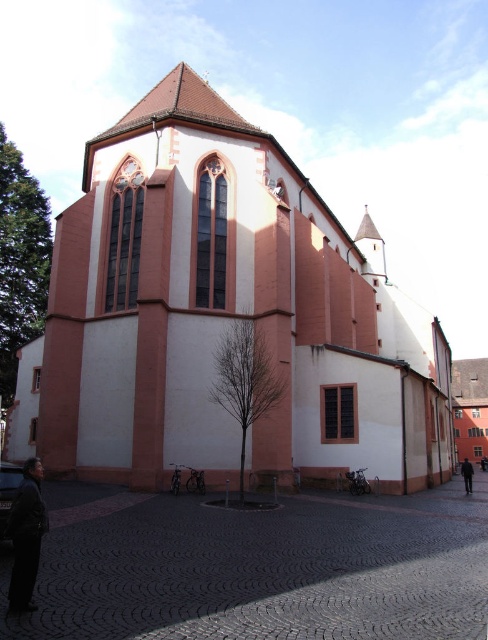
You are standing on the cobblestone path in front of the pink matte church at center. You see a black leather jacket at lower left. Which object is taller?

The pink matte church at center is taller than the black leather jacket at lower left according to the description.

You are standing in front of the historic building and see both the black leather jacket at lower left and the dark fabric jacket at lower right. Which jacket is positioned higher relative to the other?

The black leather jacket at lower left is located above the dark fabric jacket at lower right.

You are standing on the cobblestone path in front of the historic building. You see a black leather jacket at lower left and a dark fabric jacket at lower right. Which jacket is closer to you?

The black leather jacket at lower left is closer to you because it is in front of the dark fabric jacket at lower right.